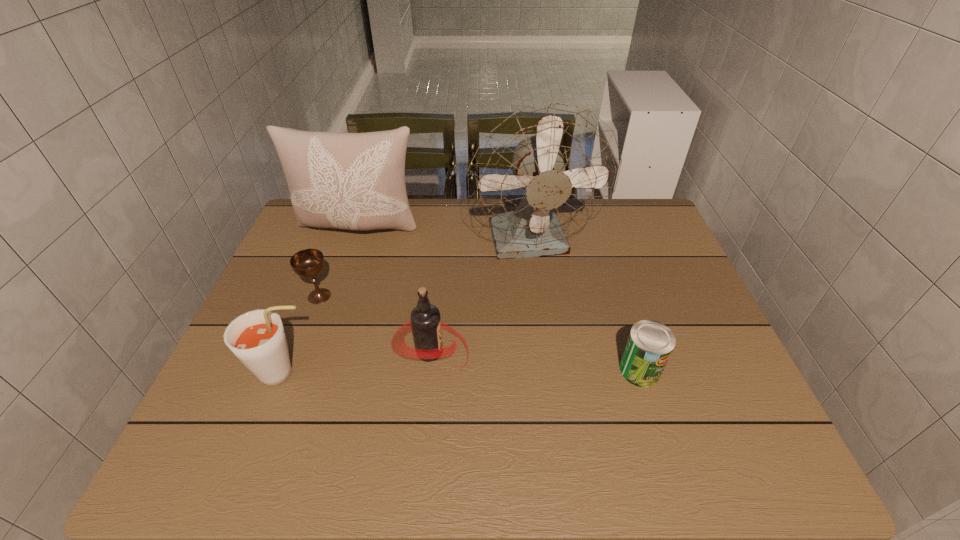
The image size is (960, 540). Identify the location of fan. (543, 173).

I want to click on the second tallest object, so click(x=356, y=181).

In order to click on the right root beer in this screenshot , I will do `click(426, 324)`.

This screenshot has width=960, height=540. I want to click on the left root beer, so click(257, 338).

The image size is (960, 540). Identify the location of the fourth nearest object. (306, 263).

Find the location of a particular element. The width and height of the screenshot is (960, 540). can is located at coordinates (650, 343).

What are the coordinates of `blank space located 0.100m in front of the fan to blow air` in the screenshot? It's located at (540, 301).

The width and height of the screenshot is (960, 540). Identify the location of free space located 0.370m on the front side of the cushion. (321, 346).

At what (x,y) coordinates should I click in order to perform the action: click on blank space located 0.120m on the label of the right root beer. Please return your answer as a coordinate pair (x, y). Looking at the image, I should click on (519, 352).

You are a GUI agent. You are given a task and a screenshot of the screen. Output one action in this format:
    pyautogui.click(x=<x>, y=<y>)
    Task: Click on the free space located 0.310m on the drink side of the left root beer
    This screenshot has height=540, width=960.
    Given the screenshot: What is the action you would take?
    pyautogui.click(x=452, y=374)